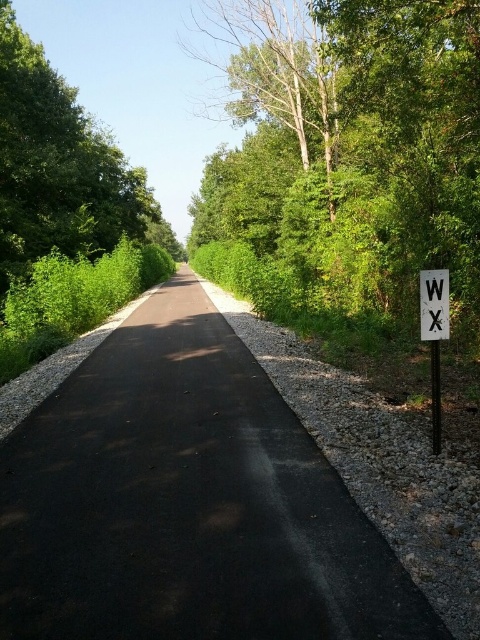
Can you confirm if green leafy tree at center is smaller than white plastic sign at right?

No.

Describe the element at coordinates (60, 168) in the screenshot. The height and width of the screenshot is (640, 480). I see `green leafy tree at center` at that location.

Find the location of a particular element. The height and width of the screenshot is (640, 480). green leafy tree at center is located at coordinates (60, 168).

Can you confirm if white plastic sign at right is positioned above white wooden sign at right?

Incorrect, white plastic sign at right is not positioned above white wooden sign at right.

Who is positioned more to the right, white plastic sign at right or white wooden sign at right?

white plastic sign at right is more to the right.

Based on the photo, who is more distant from viewer, (435, 337) or (435, 298)?

Positioned behind is point (435, 337).

Locate an element on the screen. white plastic sign at right is located at coordinates (434, 333).

Which is below, black asphalt path at center or white plastic sign at right?

black asphalt path at center is below.

Describe the element at coordinates (187, 502) in the screenshot. I see `black asphalt path at center` at that location.

Is point (109, 353) behind point (434, 397)?

Yes, point (109, 353) is behind point (434, 397).

I want to click on black asphalt path at center, so click(187, 502).